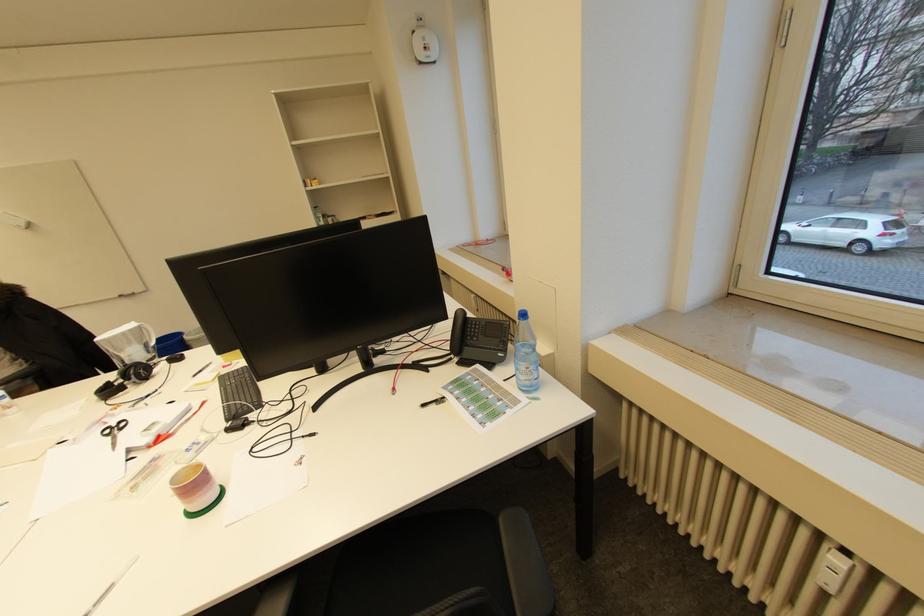
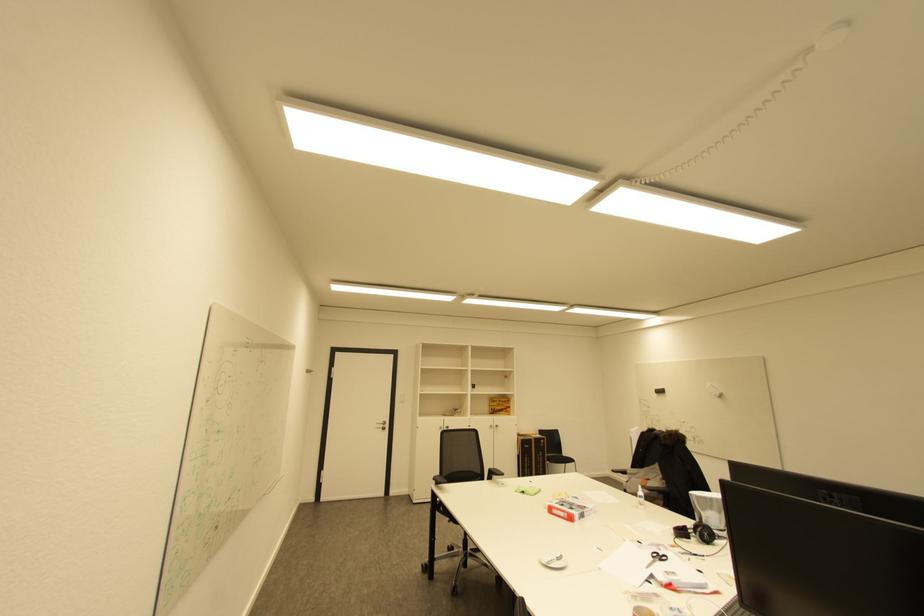
The point at [140,377] is marked in the first image. Where is the corresponding point in the second image?

(704, 533)